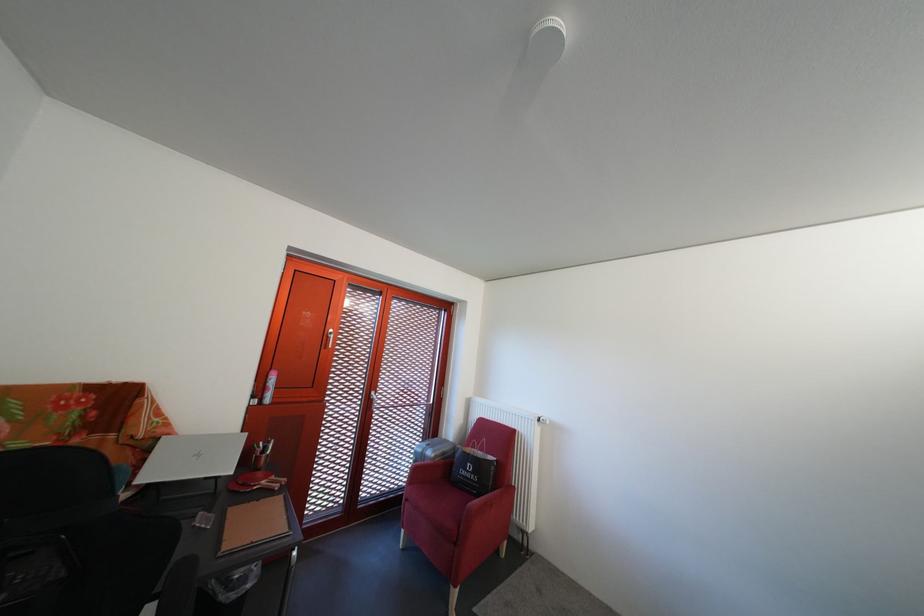
What do you see at coordinates (174, 496) in the screenshot? I see `the chair armrest` at bounding box center [174, 496].